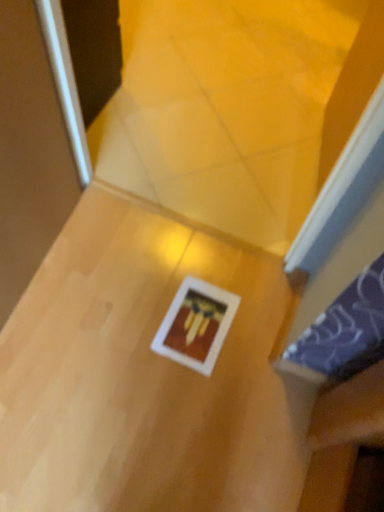
Find the location of a particular element. Image resolution: width=384 pixels, height=512 pixels. free space in front of white matte picture frame at center is located at coordinates coord(188,401).